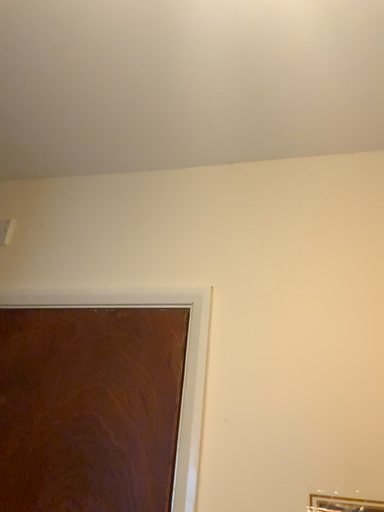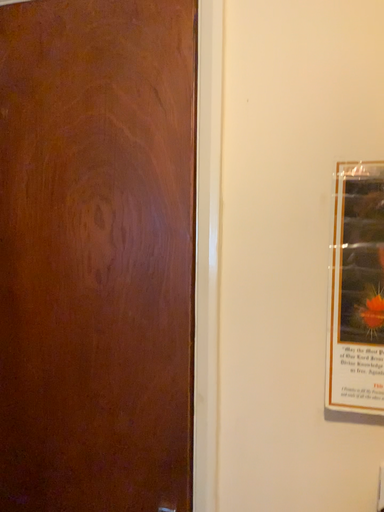
Question: How did the camera likely rotate when shooting the video?

Choices:
 (A) rotated upward
 (B) rotated downward

Answer: (B)